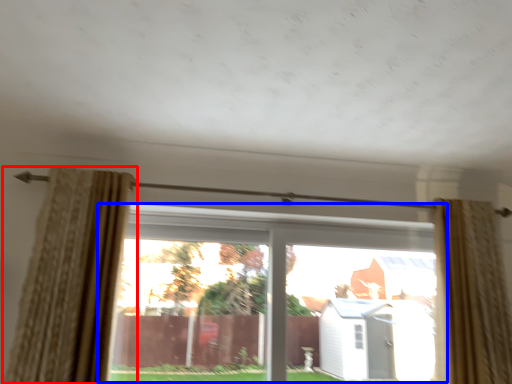
Question: Which object appears closest to the camera in this image, curtain (highlighted by a red box) or window (highlighted by a blue box)?

Choices:
 (A) curtain
 (B) window

Answer: (A)